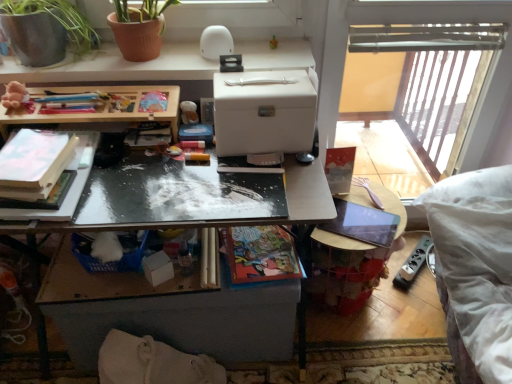
Image resolution: width=512 pixels, height=384 pixels. I want to click on unoccupied region to the right of matte cardboard book at center, marked as the second book in a right-to-left arrangement, so click(x=255, y=246).